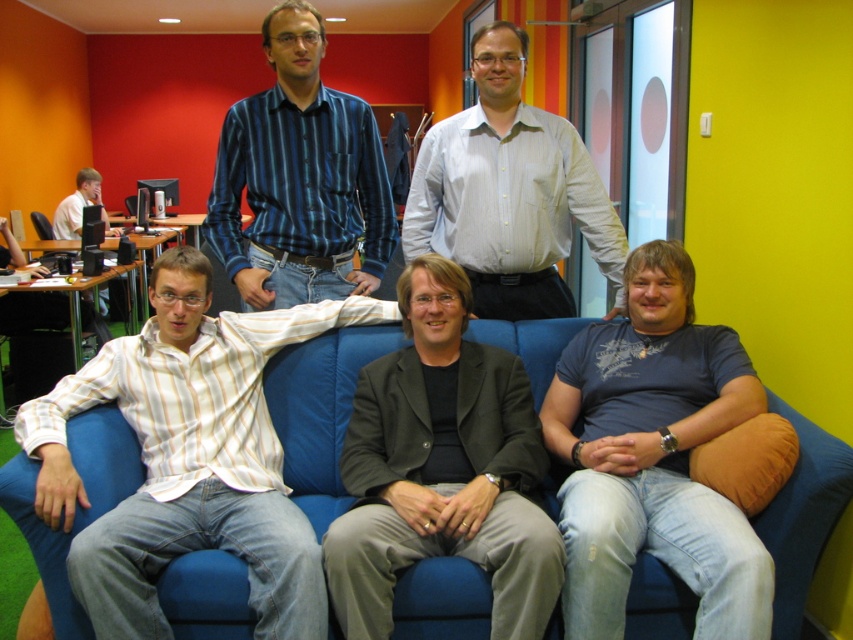
This screenshot has height=640, width=853. What are the coordinates of `white striped shirt at center` in the screenshot? It's located at (189, 456).

Is white striped shirt at center positioned at the back of matte black laptop at left?

No, white striped shirt at center is in front of matte black laptop at left.

At what (x,y) coordinates should I click in order to perform the action: click on white striped shirt at center. Please return your answer as a coordinate pair (x, y). The height and width of the screenshot is (640, 853). Looking at the image, I should click on (189, 456).

Locate an element on the screen. The width and height of the screenshot is (853, 640). white striped shirt at center is located at coordinates (189, 456).

In the scene shown: Does blue fabric couch at center appear over dark gray suit at center?

Yes.

Does blue fabric couch at center have a smaller size compared to dark gray suit at center?

No.

I want to click on blue fabric couch at center, so click(x=320, y=410).

Is point (570, 486) positioned before point (579, 138)?

Yes, point (570, 486) is closer to viewer.

Between blue cotton t-shirt at lower right and light beige shirt at center, which one is positioned lower?

blue cotton t-shirt at lower right is lower down.

The width and height of the screenshot is (853, 640). What are the coordinates of `blue cotton t-shirt at lower right` in the screenshot? It's located at click(x=653, y=458).

Locate an element on the screen. Image resolution: width=853 pixels, height=640 pixels. blue cotton t-shirt at lower right is located at coordinates (653, 458).